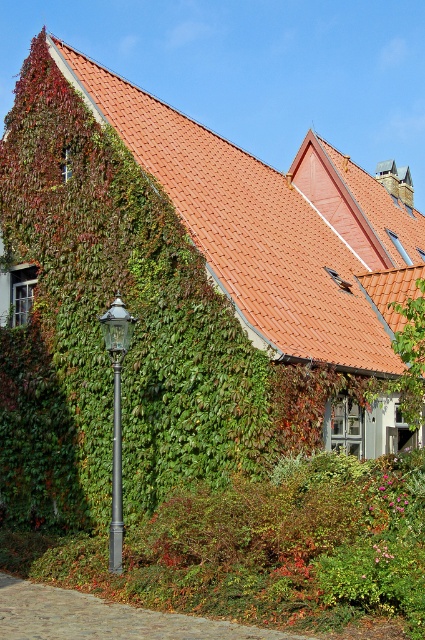
You are a painter standing at the edge of the courtyard. You want to paint the orange tile roof at upper center and the dark gray metallic pole at lower left. Which object will require a wider brush stroke to capture its full width?

The orange tile roof at upper center requires a wider brush stroke because its width is larger than the dark gray metallic pole at lower left.

You are standing in the courtyard and want to move from the dark gray metallic pole at lower left to the polished metal lamp post at left. Which direction should you walk to reach the lamp post?

You should walk to the right to reach the polished metal lamp post at left because it is positioned to the right of the dark gray metallic pole at lower left.

You are an architect analyzing the building. Which object, the orange tile roof at upper center or the polished metal lamp post at left, has a larger size in the image?

The orange tile roof at upper center is bigger than the polished metal lamp post at left.